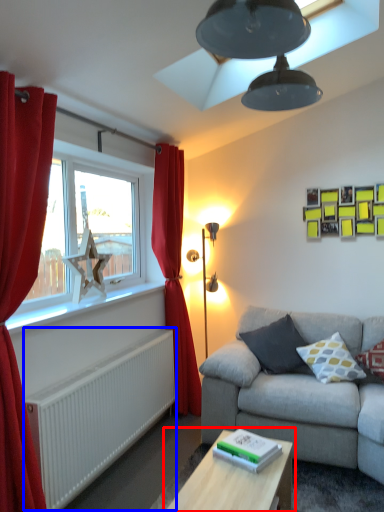
Question: Which object appears farthest to the camera in this image, table (highlighted by a red box) or radiator (highlighted by a blue box)?

Choices:
 (A) table
 (B) radiator

Answer: (B)